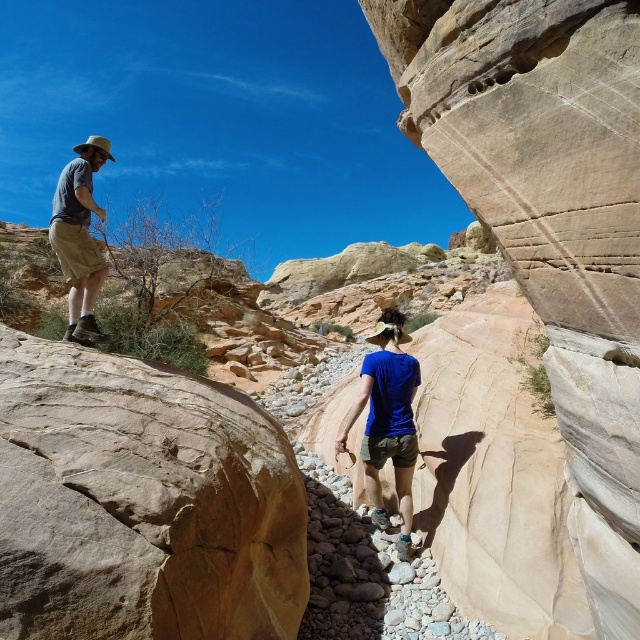
You are a hiker planning to step on the smooth beige rock at lower left and the matte gray shirt at left. Which object has a smaller width?

The smooth beige rock at lower left has a lesser width compared to the matte gray shirt at left.